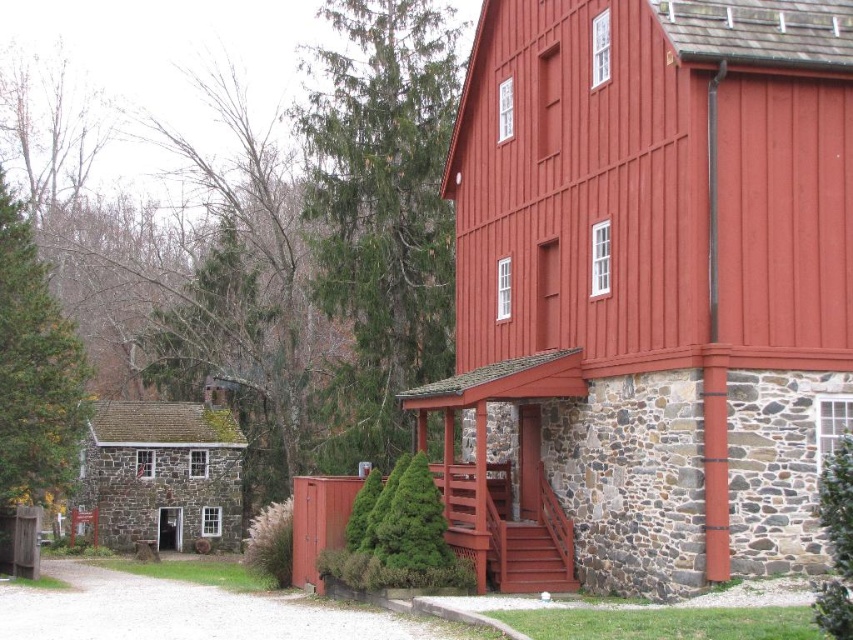
You are standing in the rural scene and want to determine which of the two points, point (548, 248) or point (843, 486), is closer to you. Based on the scene description, which point is nearer?

Point (548, 248) is closer to the viewer than point (843, 486) because the description states that point (548, 248) is further to the viewer than point (843, 486).

You are a delivery person approaching the stone house at lower left and the gray gravel driveway at lower left. Which one do you need to go around first?

The stone house at lower left is much taller than the gray gravel driveway at lower left, so you need to go around the stone house at lower left first.